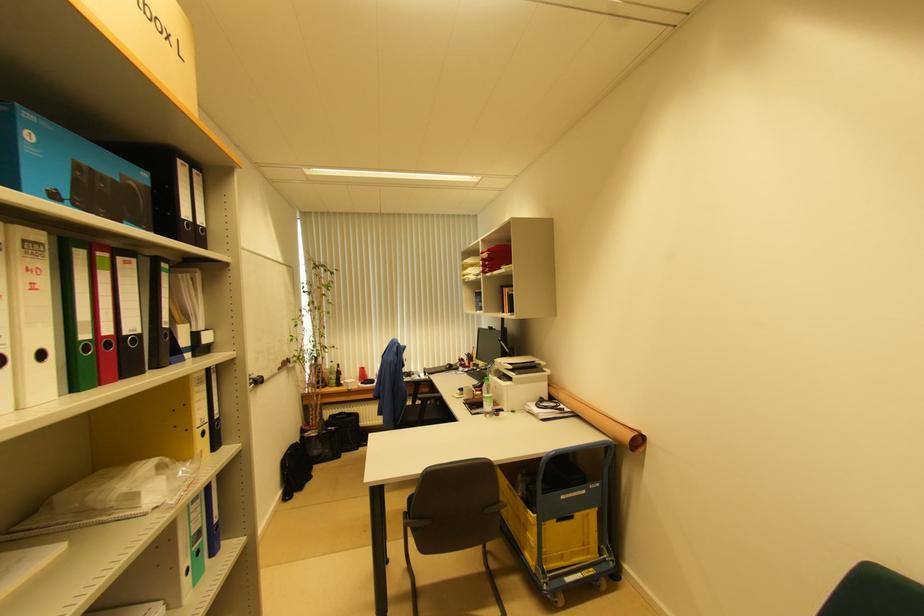
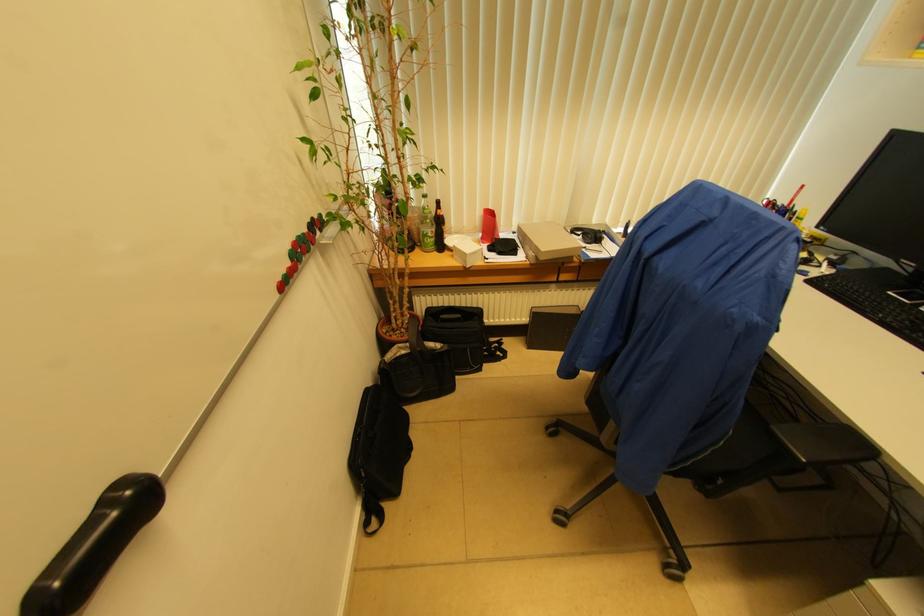
The point at (311, 480) is marked in the first image. Where is the corresponding point in the second image?

(409, 451)